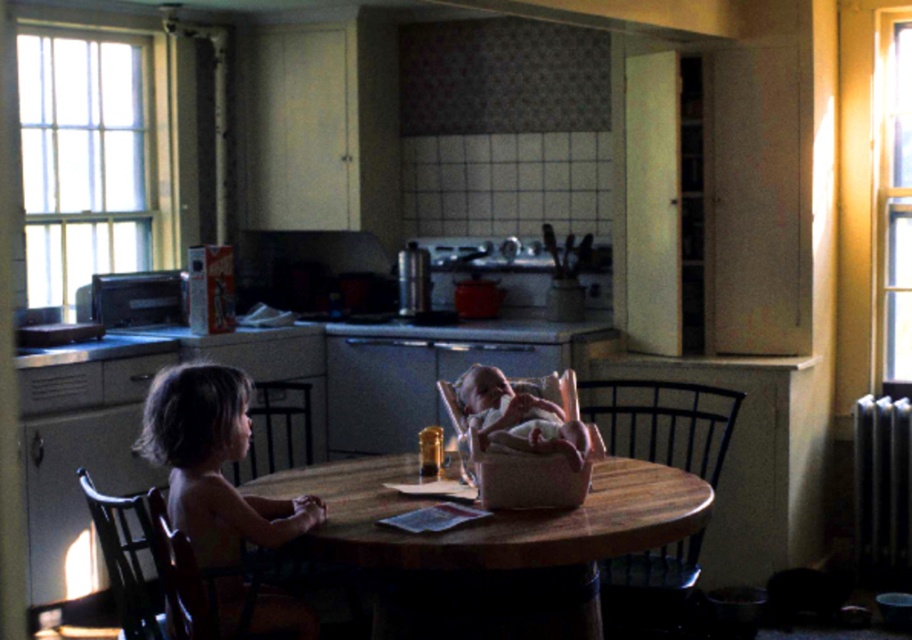
Question: Which object is the closest to the wooden table at center?

Choices:
 (A) wooden chair at left
 (B) light brown wooden chair at left

Answer: (B)

Question: Does light brown wooden chair at left have a greater width compared to wooden chair at table?

Choices:
 (A) no
 (B) yes

Answer: (A)

Question: Does wooden table at center appear on the right side of light brown wooden chair at left?

Choices:
 (A) yes
 (B) no

Answer: (A)

Question: In this image, where is wooden table at center located relative to dark wood chair at left?

Choices:
 (A) left
 (B) right

Answer: (B)

Question: Estimate the real-world distances between objects in this image. Which object is farther from the wooden chair at left?

Choices:
 (A) wooden table at center
 (B) soft white fabric at center

Answer: (B)

Question: Which point appears closest to the camera in this image?

Choices:
 (A) (491, 403)
 (B) (183, 474)
 (C) (126, 516)

Answer: (B)